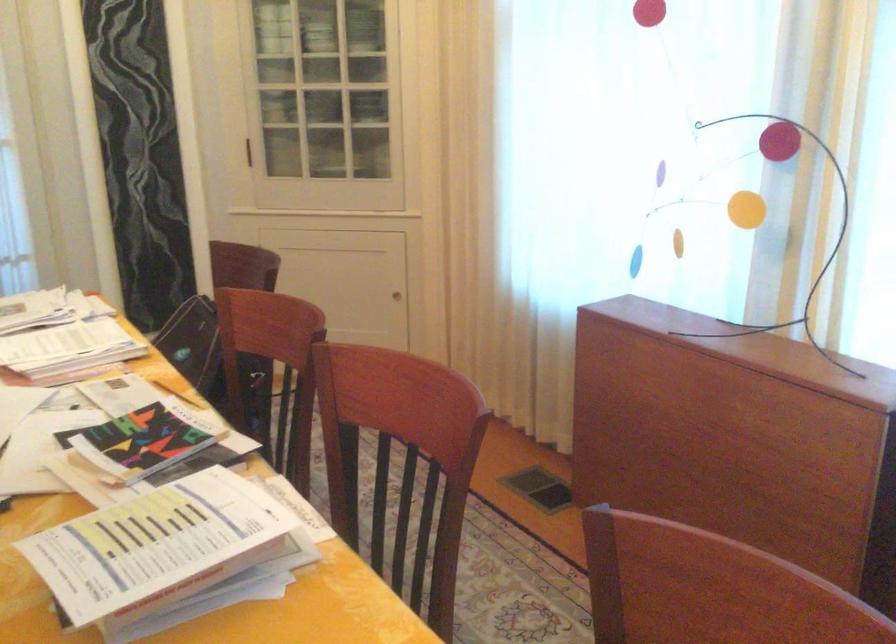
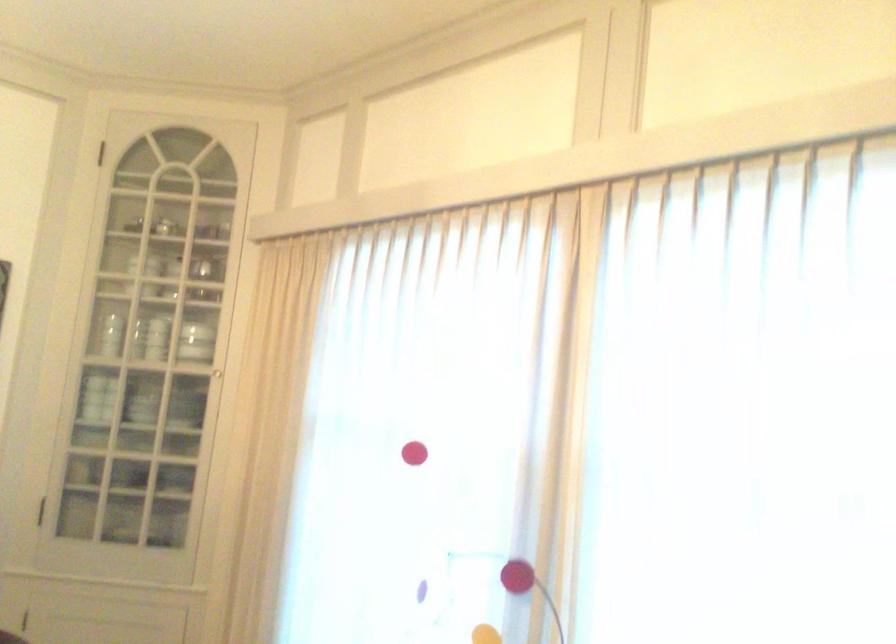
Question: Which direction would the cameraman need to move to produce the second image? Reply with the corresponding letter.

Choices:
 (A) Left
 (B) Right
 (C) Forward
 (D) Backward

Answer: (D)